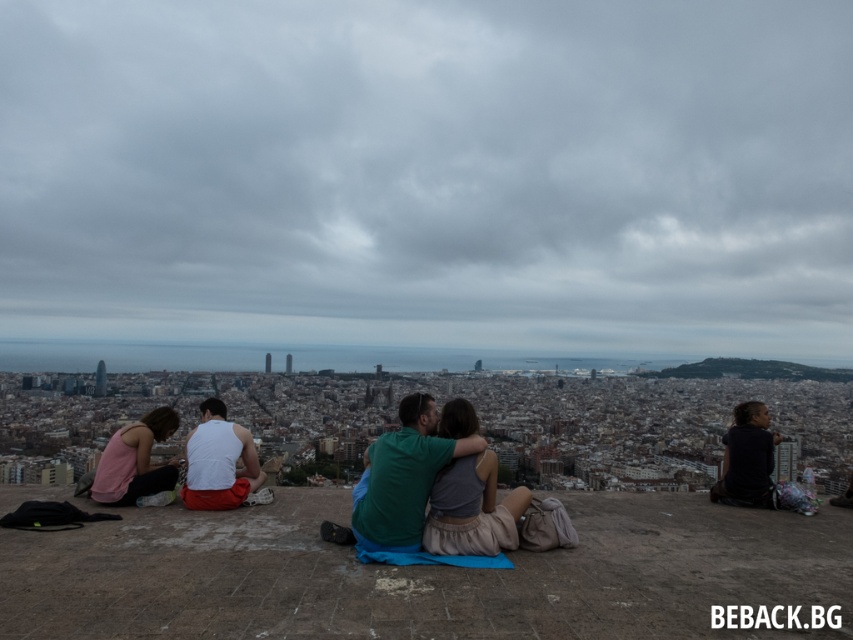
You are a fashion designer observing the group of people on the elevated platform. You need to determine which clothing item, the white matte tank top at center or the pink fabric at left, requires more fabric to produce. Based on their sizes, which one would you choose?

The white matte tank top at center has a larger size compared to the pink fabric at left, so it would require more fabric to produce.

You are standing at the origin point of the coordinate system in the image. You want to find the white matte tank top at center. Which direction should you move to reach it?

You should move towards the point with coordinates 0.722 on the x axis and 0.257 on the y axis to reach the white matte tank top at center.

You are a photographer trying to capture a candid shot of the people on the elevated platform. You notice the white matte tank top at center and the pink fabric at left. Which clothing item is positioned higher relative to the other?

The white matte tank top at center is positioned higher than the pink fabric at left because it is above it.